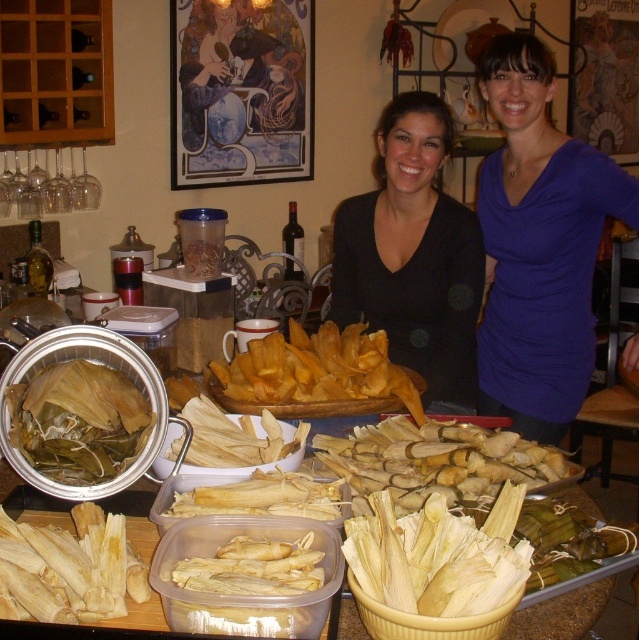
You are a chef trying to reach the white matte corn husks at center to prepare a tamale. The black matte shirt at center is in your way. Can you move the shirt to access the husks?

The white matte corn husks at center is behind the black matte shirt at center, so you can move the shirt to access the husks.

You are a chef observing the kitchen scene. You notice the black matte shirt at center and the white matte corn husks at center. Which object is taller when viewed from the front?

The black matte shirt at center is taller than the white matte corn husks at center.

You are a chef arranging tamales on a counter. You have the yellow paper tamales at center and white matte corn husks at center. Which item takes up more horizontal space when placed side by side?

The yellow paper tamales at center have a greater width than the white matte corn husks at center, so they take up more horizontal space when placed side by side.